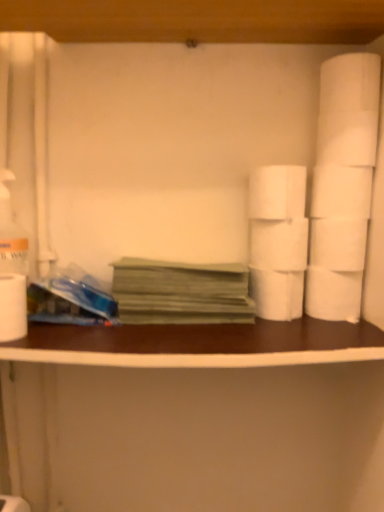
Question: From a real-world perspective, is green paper at center physically located above or below white matte toilet paper at right, placed as the seventh toilet paper when sorted from right to left?

Choices:
 (A) above
 (B) below

Answer: (B)

Question: From the image's perspective, is green paper at center located above or below white matte toilet paper at right, placed as the seventh toilet paper when sorted from right to left?

Choices:
 (A) above
 (B) below

Answer: (B)

Question: Which of these objects is positioned farthest from the white matte toilet paper at right, arranged as the 7th toilet paper when viewed from the left?

Choices:
 (A) white matte toilet paper at right, the 4th toilet paper positioned from the right
 (B) white matte toilet paper at right, placed as the third toilet paper when sorted from right to left
 (C) white matte toilet paper at right, arranged as the fifth toilet paper when viewed from the right
 (D) white matte toilet paper at right, placed as the eighth toilet paper when sorted from left to right
 (E) white matte toilet paper at right, placed as the seventh toilet paper when sorted from right to left

Answer: (A)

Question: Considering the real-world distances, which object is closest to the white matte paper towel at right?

Choices:
 (A) white matte toilet paper at left, which is the 8th toilet paper in right-to-left order
 (B) white matte toilet paper at right, which appears as the 2th toilet paper when viewed from the left
 (C) white matte toilet paper at right, the fifth toilet paper positioned from the left
 (D) white matte counter top at center
 (E) white matte toilet paper at center, which appears as the sixth toilet paper when viewed from the right

Answer: (B)